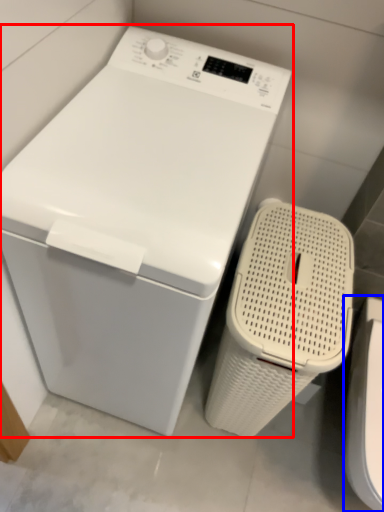
Question: Among these objects, which one is farthest to the camera, washing machine (highlighted by a red box) or washer (highlighted by a blue box)?

Choices:
 (A) washing machine
 (B) washer

Answer: (B)